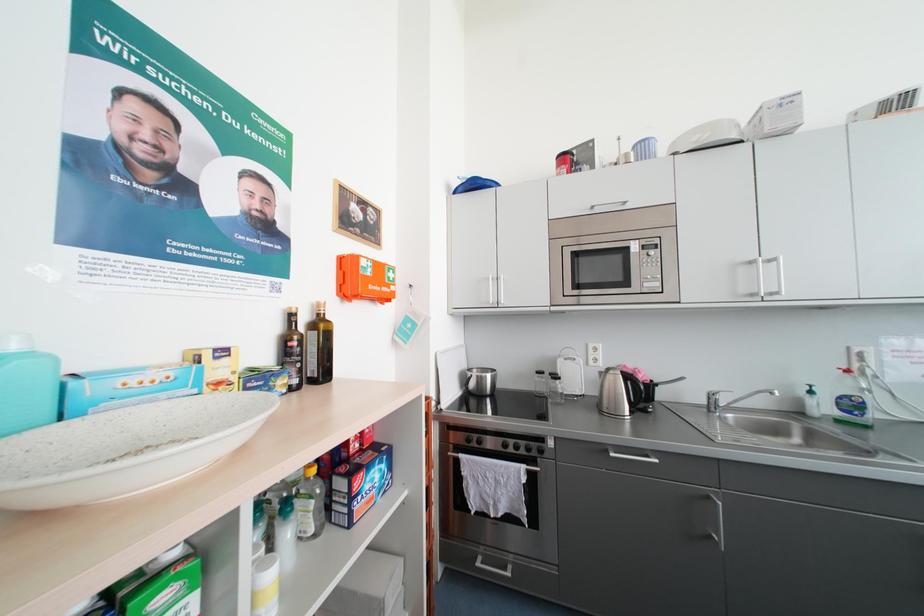
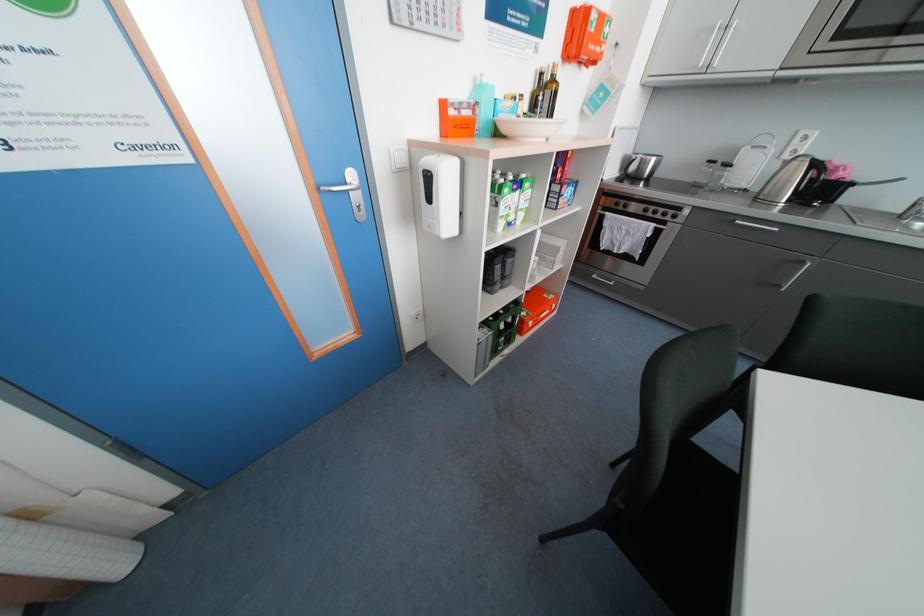
Based on the continuous images, in which direction is the camera rotating?

The camera rotated toward left-down.